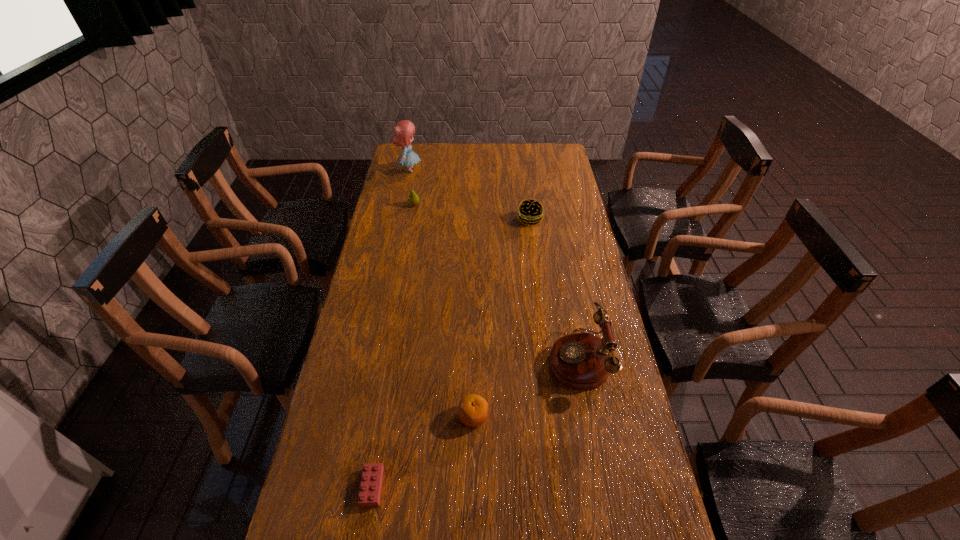
The height and width of the screenshot is (540, 960). What are the coordinates of `vacant region between the tallest object and the pear` in the screenshot? It's located at (412, 187).

You are a GUI agent. You are given a task and a screenshot of the screen. Output one action in this format:
    pyautogui.click(x=<x>, y=<y>)
    Task: Click on the empty location between the pear and the Lego
    This screenshot has height=540, width=960.
    Given the screenshot: What is the action you would take?
    pyautogui.click(x=394, y=346)

Find the location of a particular element. The image size is (960, 540). vacant space in between the second farthest object and the telephone is located at coordinates (496, 281).

Locate an element on the screen. free space between the fifth nearest object and the nearest object is located at coordinates (394, 346).

Identify the location of empty space between the third farthest object and the Lego. (451, 353).

Locate an element on the screen. The image size is (960, 540). free space between the pear and the tallest object is located at coordinates (412, 187).

The width and height of the screenshot is (960, 540). Identify the location of vacant region between the pear and the shortest object. (394, 346).

Locate an element on the screen. This screenshot has width=960, height=540. the third closest object relative to the doll is located at coordinates (580, 360).

The height and width of the screenshot is (540, 960). What are the coordinates of `the fifth closest object to the Lego` in the screenshot? It's located at (403, 131).

This screenshot has width=960, height=540. In order to click on free region that satisfies the following two spatial constraints: 1. on the dial of the fifth shortest object; 2. on the front side of the nearest object in this screenshot , I will do `click(602, 487)`.